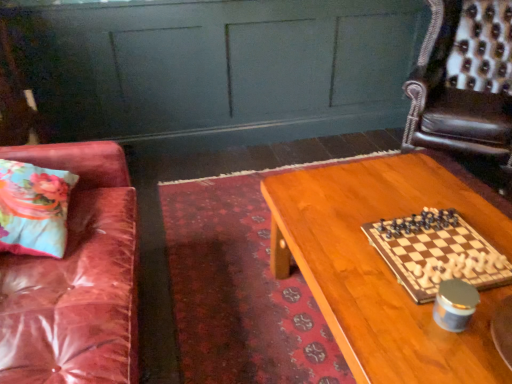
Question: Does wooden chessboard at center have a lesser height compared to floral fabric pillow at left?

Choices:
 (A) no
 (B) yes

Answer: (B)

Question: From a real-world perspective, is wooden chessboard at center beneath floral fabric pillow at left?

Choices:
 (A) no
 (B) yes

Answer: (B)

Question: Can you confirm if wooden chessboard at center is thinner than floral fabric pillow at left?

Choices:
 (A) no
 (B) yes

Answer: (A)

Question: Considering the relative sizes of wooden chessboard at center and floral fabric pillow at left in the image provided, is wooden chessboard at center wider than floral fabric pillow at left?

Choices:
 (A) yes
 (B) no

Answer: (A)

Question: Does wooden chessboard at center come behind floral fabric pillow at left?

Choices:
 (A) yes
 (B) no

Answer: (B)

Question: Is wooden chessboard at center looking in the opposite direction of floral fabric pillow at left?

Choices:
 (A) yes
 (B) no

Answer: (A)

Question: Considering the relative sizes of leather armchair at upper right and floral fabric pillow at left in the image provided, is leather armchair at upper right taller than floral fabric pillow at left?

Choices:
 (A) yes
 (B) no

Answer: (A)

Question: Is leather armchair at upper right oriented towards floral fabric pillow at left?

Choices:
 (A) yes
 (B) no

Answer: (B)

Question: Is leather armchair at upper right further to the viewer compared to floral fabric pillow at left?

Choices:
 (A) yes
 (B) no

Answer: (A)

Question: From a real-world perspective, is leather armchair at upper right over floral fabric pillow at left?

Choices:
 (A) no
 (B) yes

Answer: (A)

Question: From the image's perspective, is leather armchair at upper right over floral fabric pillow at left?

Choices:
 (A) yes
 (B) no

Answer: (A)

Question: From a real-world perspective, is leather armchair at upper right positioned under floral fabric pillow at left based on gravity?

Choices:
 (A) yes
 (B) no

Answer: (A)

Question: From a real-world perspective, is floral fabric pillow at left physically below wooden table at center?

Choices:
 (A) no
 (B) yes

Answer: (A)